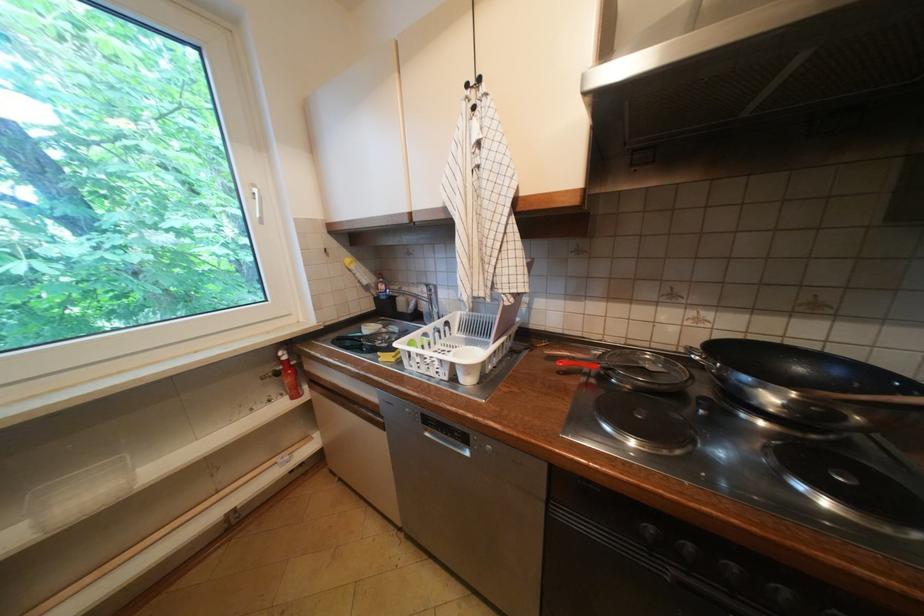
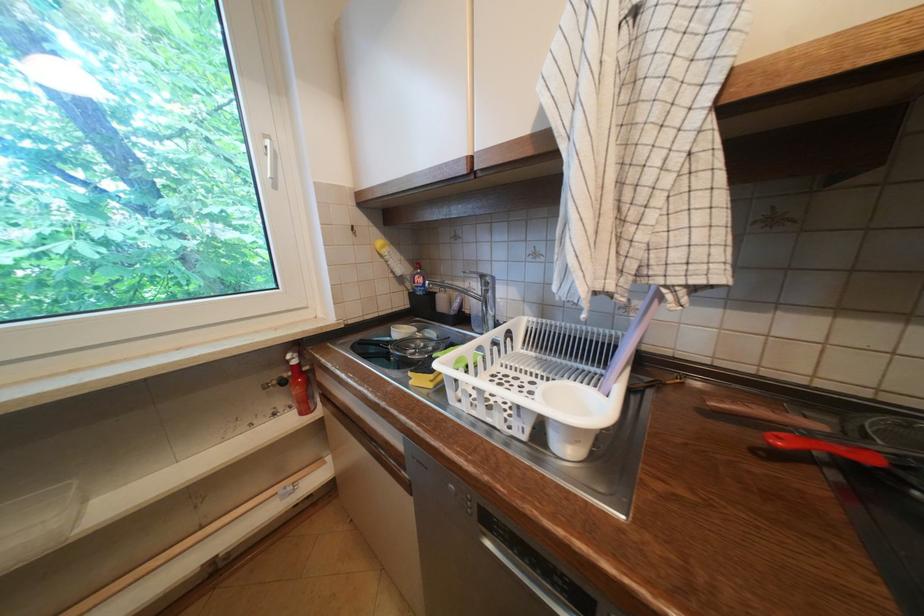
Locate, in the second image, the point that corresponds to pixel 569 363 in the first image.

(788, 440)